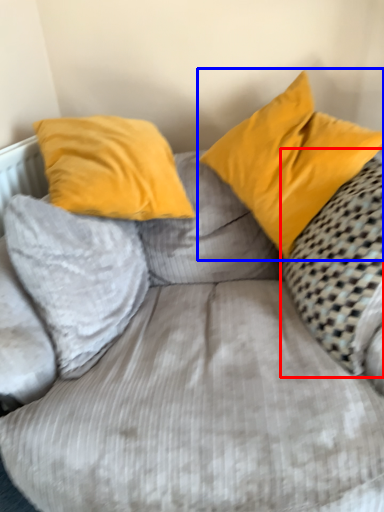
Question: Among these objects, which one is nearest to the camera, pillow (highlighted by a red box) or pillow (highlighted by a blue box)?

Choices:
 (A) pillow
 (B) pillow

Answer: (A)